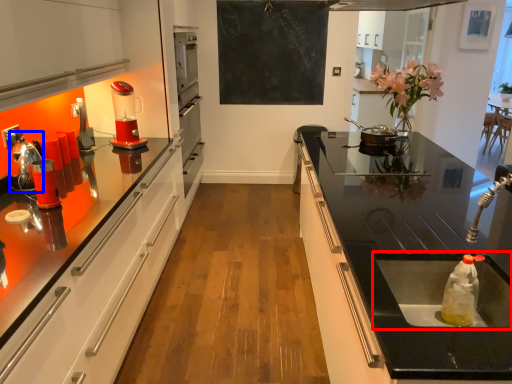
Question: Which of the following is the closest to the observer, sink (highlighted by a red box) or appliance (highlighted by a blue box)?

Choices:
 (A) sink
 (B) appliance

Answer: (A)